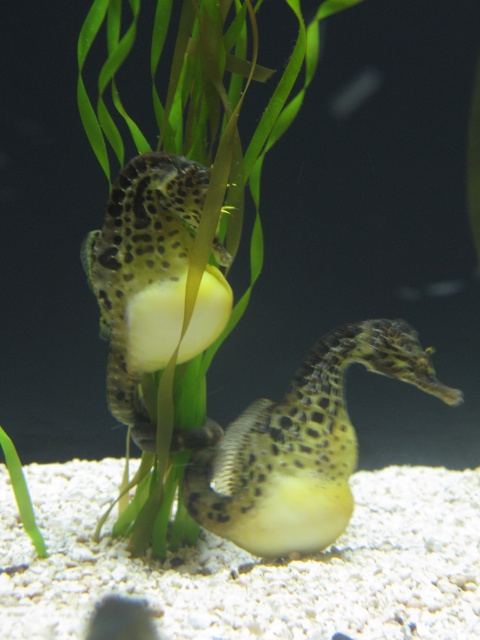
Question: Which object is farther from the camera taking this photo?

Choices:
 (A) leopard-patterned seahorse at center
 (B) green leafy plant at center

Answer: (A)

Question: Does green leafy plant at center have a lesser width compared to leopard-patterned seahorse at center?

Choices:
 (A) yes
 (B) no

Answer: (A)

Question: Which of the following is the closest to the observer?

Choices:
 (A) (324, 412)
 (B) (231, 180)

Answer: (B)

Question: Does green leafy plant at center have a lesser width compared to leopard-patterned seahorse at center?

Choices:
 (A) no
 (B) yes

Answer: (B)

Question: Does green leafy plant at center have a smaller size compared to leopard-patterned seahorse at center?

Choices:
 (A) no
 (B) yes

Answer: (A)